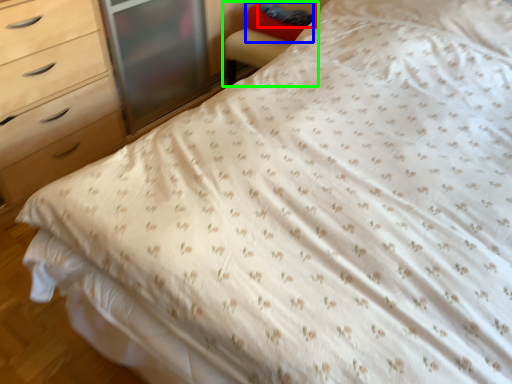
Question: Which is farther away from pillow (highlighted by a red box)? pillow (highlighted by a blue box) or armchair (highlighted by a green box)?

Choices:
 (A) pillow
 (B) armchair

Answer: (B)